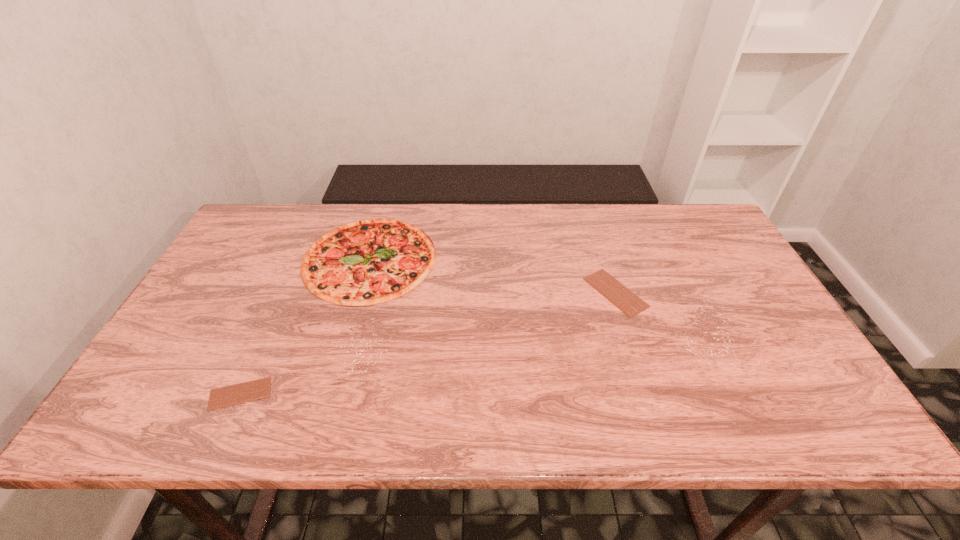
Locate an element on the screen. free region that satisfies the following two spatial constraints: 1. on the front side of the taller chocolate bar; 2. on the right side of the tallest object is located at coordinates (360, 293).

Locate an element on the screen. This screenshot has width=960, height=540. free location that satisfies the following two spatial constraints: 1. on the back side of the shortest object; 2. on the right side of the rightmost object is located at coordinates (286, 293).

Locate an element on the screen. This screenshot has height=540, width=960. blank area in the image that satisfies the following two spatial constraints: 1. on the back side of the shorter chocolate bar; 2. on the left side of the rightmost object is located at coordinates (x=286, y=293).